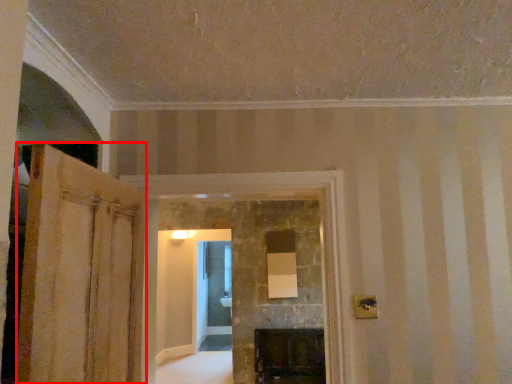
Question: From the image's perspective, where is door (annotated by the red box) located in relation to fireplace in the image?

Choices:
 (A) above
 (B) below

Answer: (A)